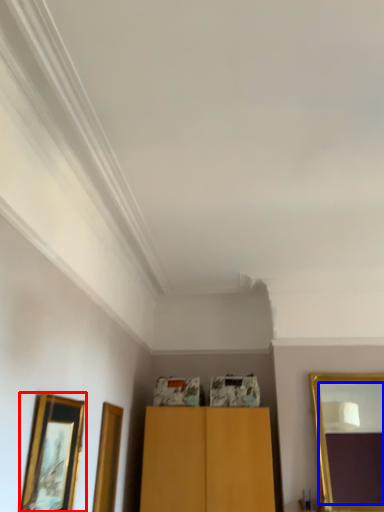
Question: Which of the following is the farthest to the observer, picture frame (highlighted by a red box) or mirror (highlighted by a blue box)?

Choices:
 (A) picture frame
 (B) mirror

Answer: (B)